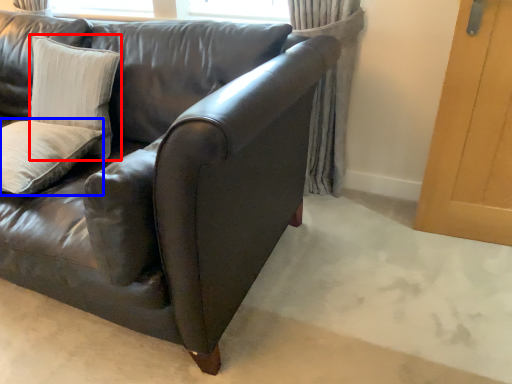
Question: Which of the following is the farthest to the observer, pillow (highlighted by a red box) or pillow (highlighted by a blue box)?

Choices:
 (A) pillow
 (B) pillow

Answer: (A)